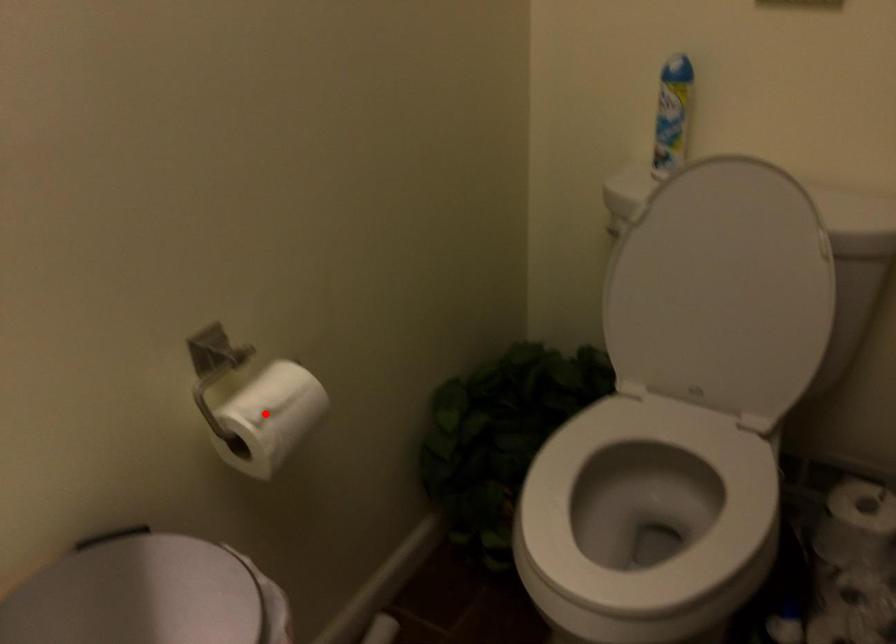
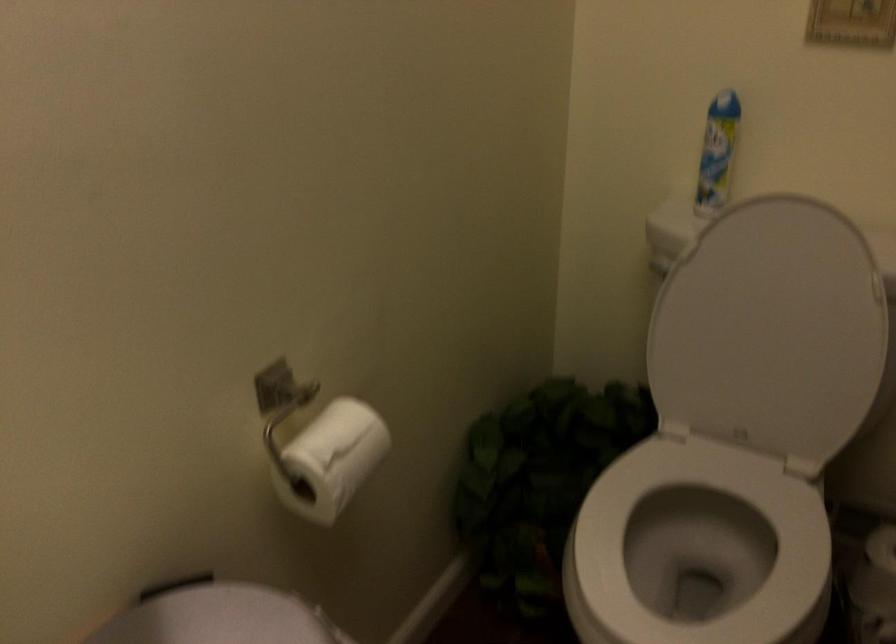
Locate, in the second image, the point that corresponds to the highlighted location in the first image.

(331, 459)